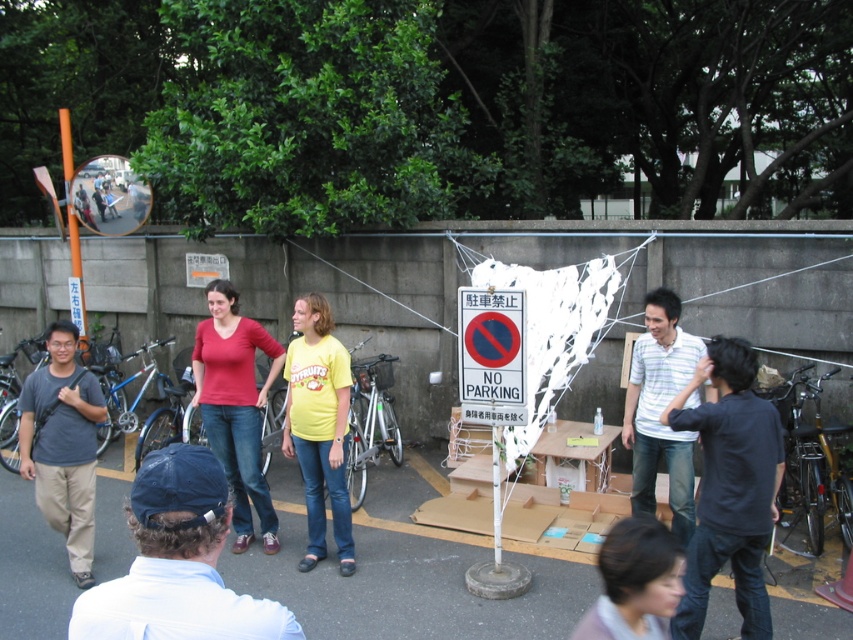
You are standing at the point labeled point (688, 348) and want to walk towards the point labeled point (654, 566). Which direction should you move in relation to the camera?

You should move away from the camera because point (688, 348) is closer to the camera than point (654, 566).

You are standing in the park and see two people wearing the matte red shirt at center and the yellow cotton shirt at center. Which one is closer to you?

The matte red shirt at center is closer to you because it is positioned further to the viewer than the yellow cotton shirt at center.